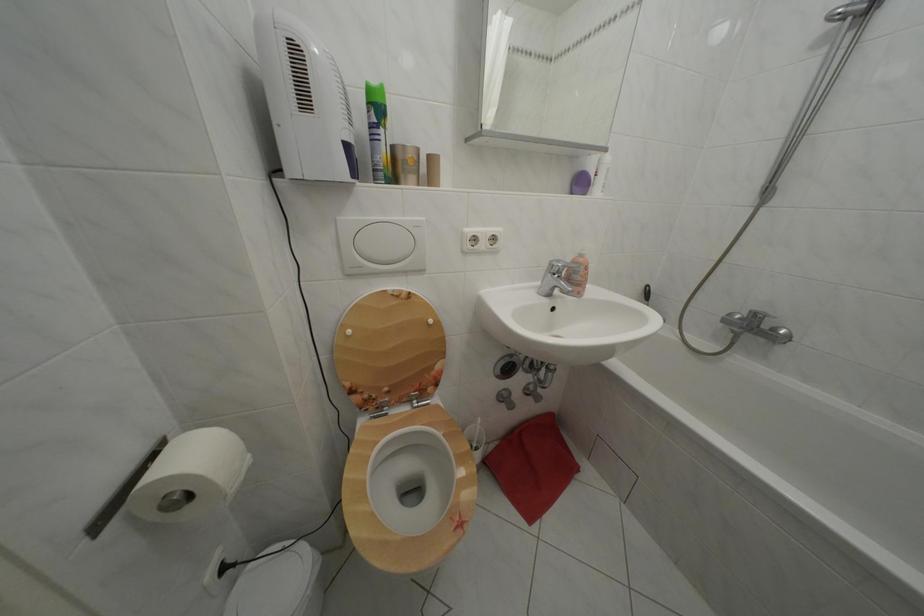
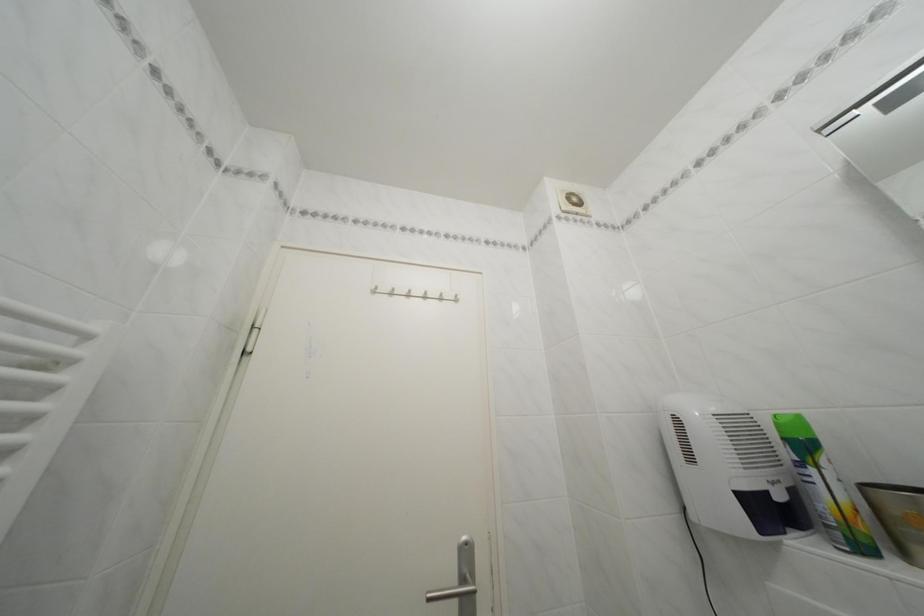
Where in the second image is the point corresponding to point 378,110 from the first image?

(793, 445)